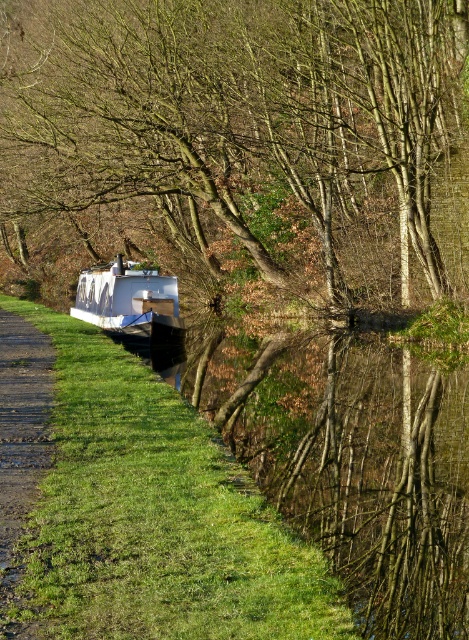
Question: Which point is farther to the camera?

Choices:
 (A) white matte boat at center
 (B) gravel path at lower left
 (C) brown leafy tree at upper center
 (D) green grass at lower left

Answer: (A)

Question: Based on their relative distances, which object is nearer to the gravel path at lower left?

Choices:
 (A) white matte boat at center
 (B) brown leafy tree at upper center

Answer: (A)

Question: Can you confirm if gravel path at lower left is smaller than white matte boat at center?

Choices:
 (A) no
 (B) yes

Answer: (A)

Question: Can you confirm if brown leafy tree at upper center is positioned to the left of green grass at lower left?

Choices:
 (A) yes
 (B) no

Answer: (A)

Question: Which of these objects is positioned closest to the green grass at lower left?

Choices:
 (A) gravel path at lower left
 (B) white matte boat at center
 (C) brown leafy tree at upper center

Answer: (A)

Question: Is brown leafy tree at upper center behind gravel path at lower left?

Choices:
 (A) yes
 (B) no

Answer: (A)